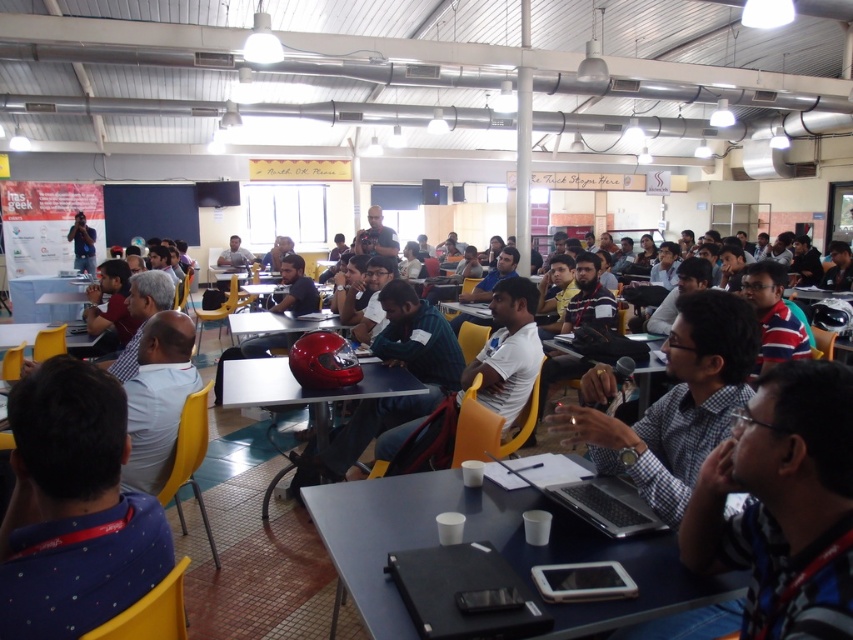
Question: Can you confirm if green fabric shirt at center is positioned to the right of yellow plastic table at center?

Choices:
 (A) no
 (B) yes

Answer: (B)

Question: Does glossy plastic table at center appear on the right side of shiny plastic table at center?

Choices:
 (A) no
 (B) yes

Answer: (B)

Question: Which point is farther to the camera?

Choices:
 (A) blue plastic table at lower center
 (B) matte black laptop at center

Answer: (B)

Question: Which object appears closest to the camera in this image?

Choices:
 (A) green fabric shirt at center
 (B) shiny plastic table at center
 (C) matte black laptop at center

Answer: (A)

Question: Can you confirm if green fabric shirt at center is bigger than matte black laptop at center?

Choices:
 (A) yes
 (B) no

Answer: (A)

Question: Which point is closer to the camera?

Choices:
 (A) white matte shirt at center
 (B) green fabric shirt at center
 (C) yellow plastic table at center

Answer: (A)